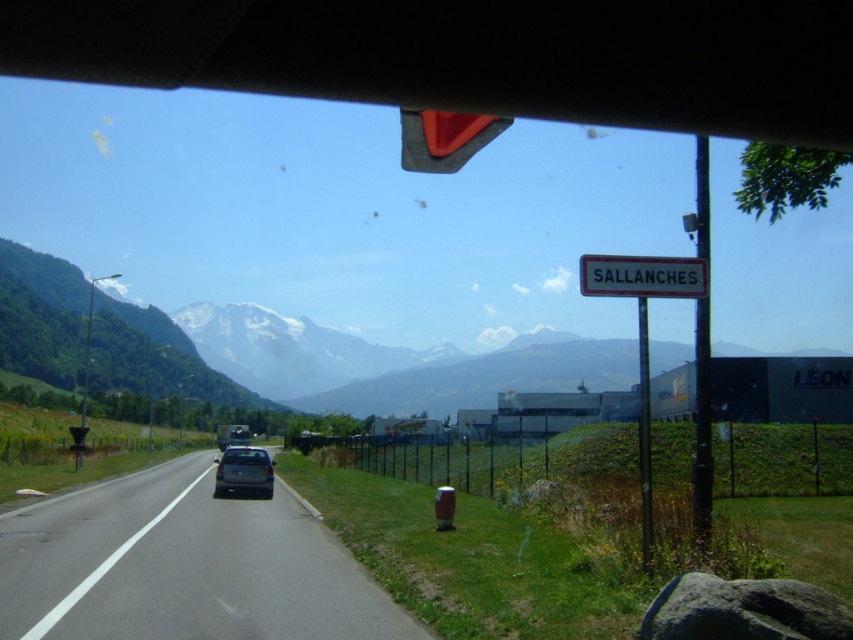
Can you confirm if white plastic sign at upper center is taller than slate gray metallic car at center?

Incorrect, white plastic sign at upper center's height is not larger of slate gray metallic car at center's.

Which is in front, point (683, 285) or point (218, 460)?

Point (683, 285)

Does point (582, 291) come farther from viewer compared to point (225, 452)?

That is False.

Locate an element on the screen. This screenshot has height=640, width=853. white plastic sign at upper center is located at coordinates (643, 276).

Measure the distance from smooth asphalt road at center to slate gray metallic car at center.

smooth asphalt road at center and slate gray metallic car at center are 19.03 feet apart from each other.

Is point (45, 589) more distant than point (247, 476)?

No.

Identify the location of smooth asphalt road at center. (183, 566).

Consider the image. Does white plastic sign at right come in front of white plastic sign at upper center?

Yes, it is.

Is point (625, 262) behind point (679, 266)?

No, (625, 262) is in front of (679, 266).

What do you see at coordinates (643, 332) in the screenshot? The image size is (853, 640). I see `white plastic sign at right` at bounding box center [643, 332].

Locate an element on the screen. The image size is (853, 640). white plastic sign at right is located at coordinates (643, 332).